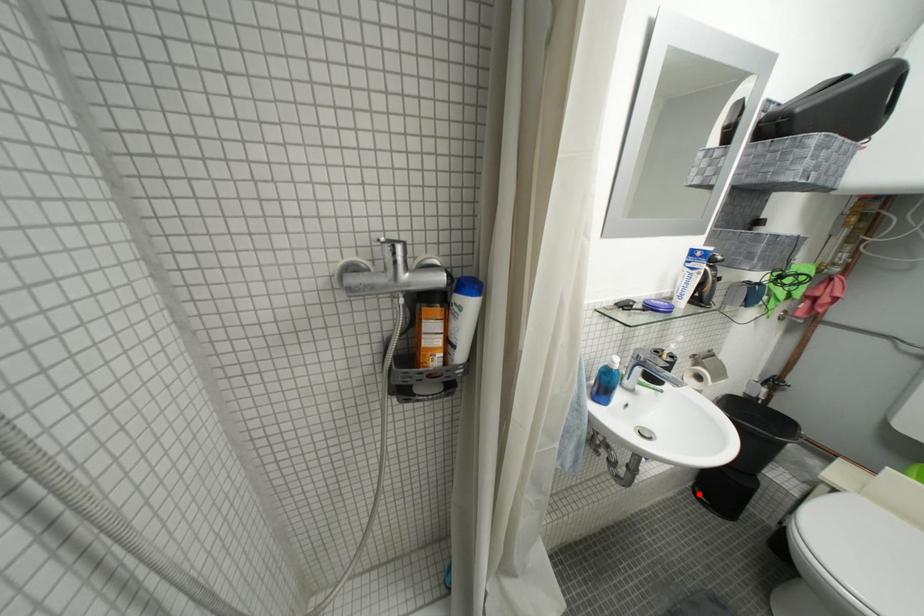
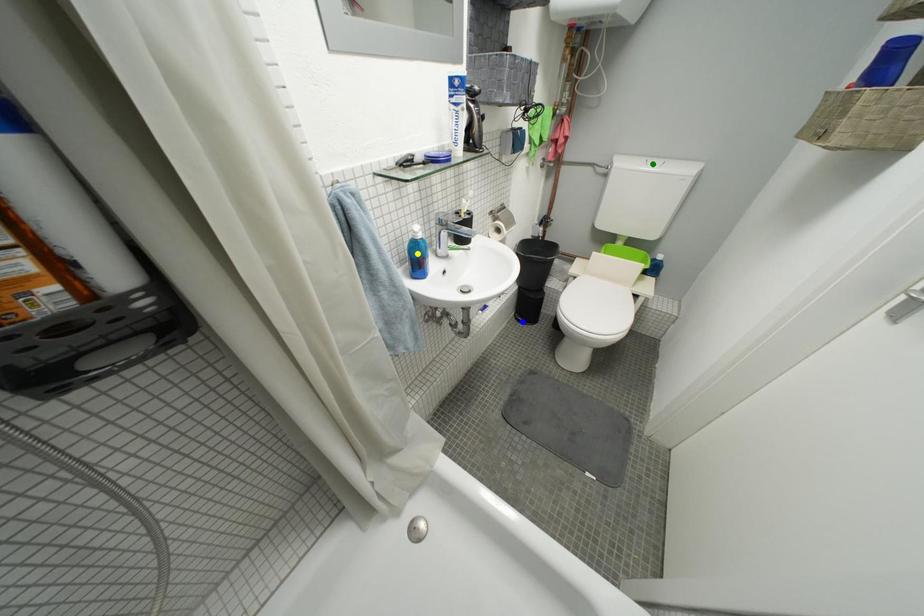
Question: I am providing you with two images of the same scene from different viewpoints. A red point is marked on the first image. You are given multiple points on the second image. Which spot in image 2 lines up with the point in image 1?

Choices:
 (A) green point
 (B) yellow point
 (C) blue point

Answer: (C)